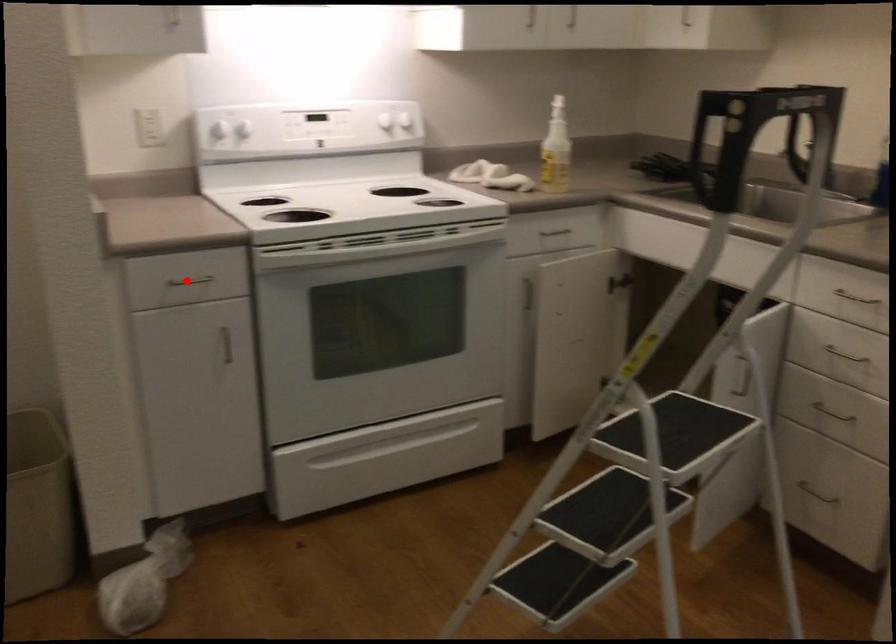
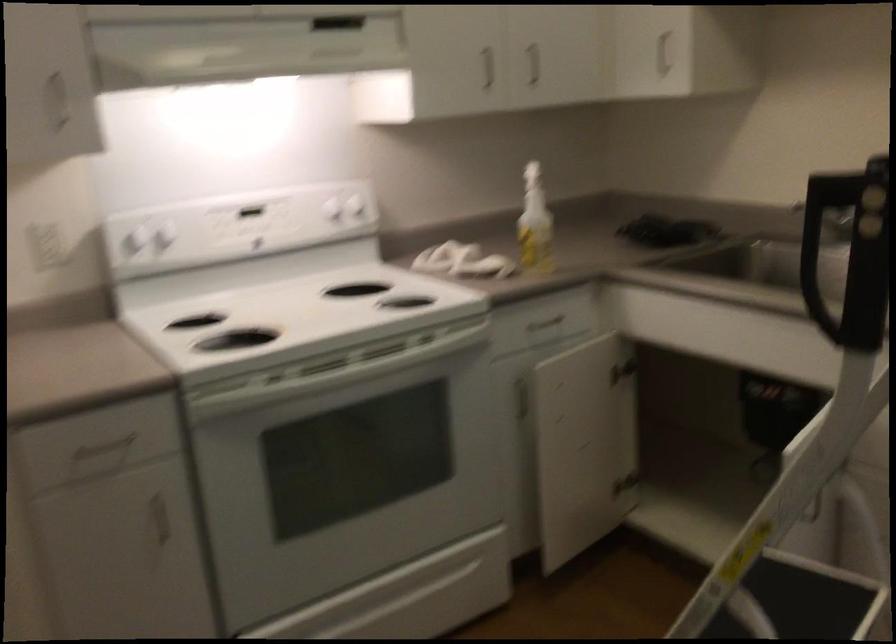
In the second image, find the point that corresponds to the highlighted location in the first image.

(102, 448)